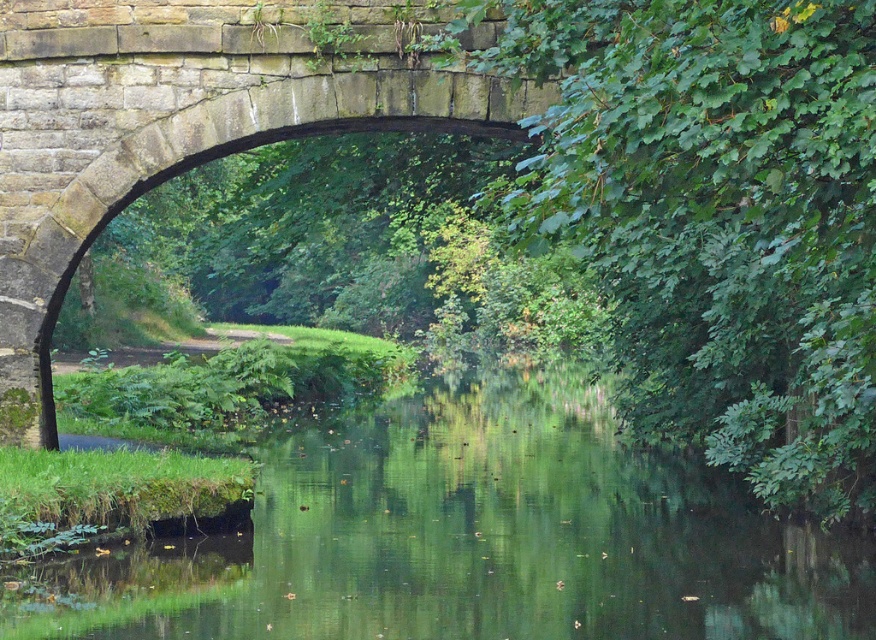
You are standing at the center of the stone bridge and want to know where the green smooth water at center is positioned relative to you. Is it directly below or to the side?

The green smooth water at center is located at point coordinates that place it directly below the stone bridge where you are standing.

You are standing on the stone bridge at center and want to observe the green smooth water at center. In which direction should you look to see it?

The green smooth water at center is positioned on the right side of the stone bridge at center, so you should look to your right to see it.